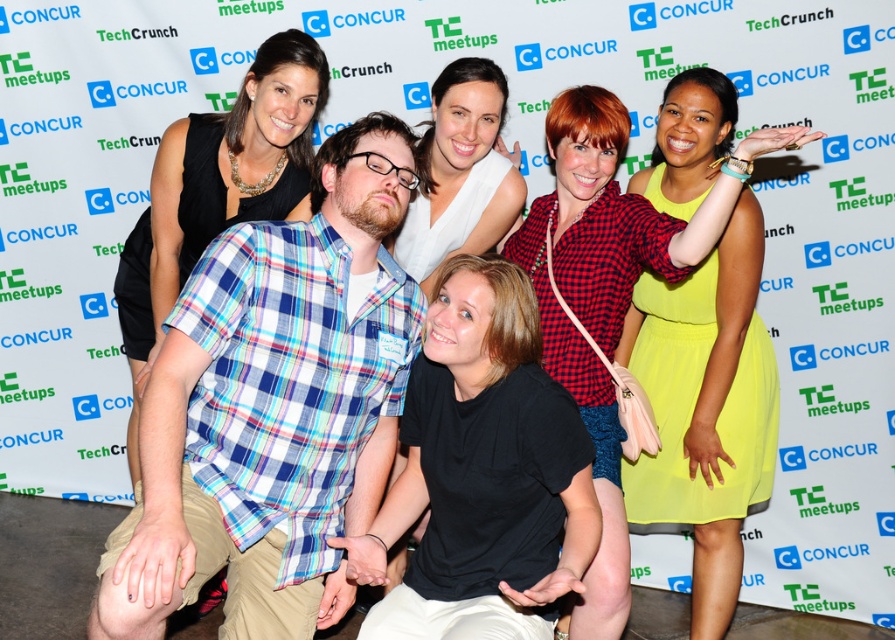
In the scene described, where exactly is the neon yellow dress at upper right positioned in terms of coordinates?

The neon yellow dress at upper right is positioned at coordinates point (706,406).

You are attending the TechCrunch meetup and need to find the person wearing the matte red checkered shirt at center. Based on the scene description, where should you look relative to the group?

The matte red checkered shirt at center is located at point 0.472 on the horizontal axis and 0.670 on the vertical axis, so you should look towards the center of the image slightly towards the lower half to find the person wearing it.